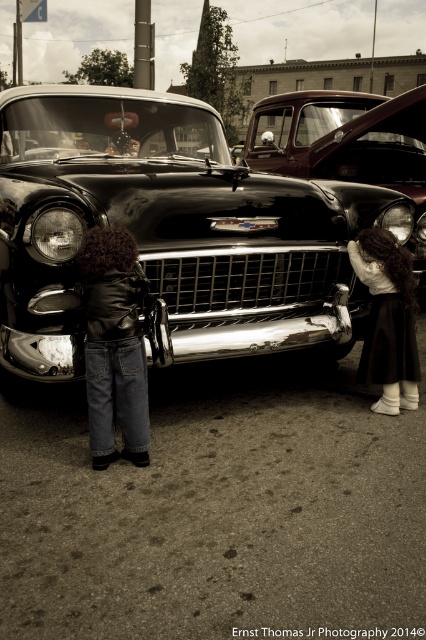
Question: Does shiny black car at center have a lesser width compared to leather jacket at center?

Choices:
 (A) yes
 (B) no

Answer: (B)

Question: Does shiny black car at center appear on the left side of shiny chrome pickup truck at center?

Choices:
 (A) no
 (B) yes

Answer: (B)

Question: Can you confirm if shiny chrome pickup truck at center is positioned to the right of leather jacket at center?

Choices:
 (A) no
 (B) yes

Answer: (B)

Question: Which point is closer to the camera?

Choices:
 (A) (403, 307)
 (B) (132, 387)
 (C) (371, 188)
 (D) (350, 177)

Answer: (B)

Question: Which point appears closest to the camera in this image?

Choices:
 (A) (322, 131)
 (B) (396, 268)
 (C) (52, 90)
 (D) (143, 412)

Answer: (D)

Question: Which point is closer to the camera taking this photo?

Choices:
 (A) (270, 166)
 (B) (382, 404)

Answer: (B)